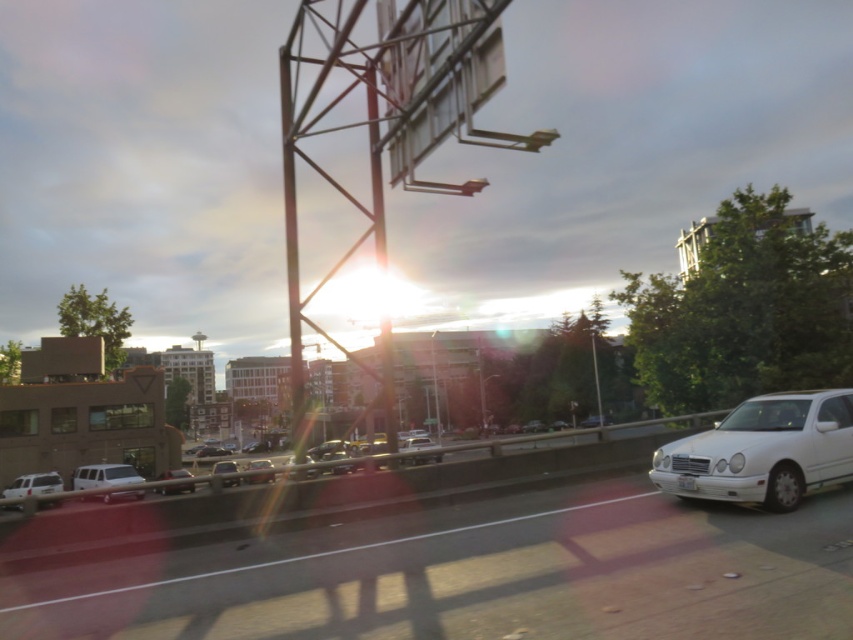
You are a driver in the shiny silver sedan at center. You notice the matte black sedan at center in front of you. If you want to overtake it, which direction should you choose based on the road layout?

The matte black sedan at center is in front of the shiny silver sedan at center, so to overtake it, you should move to the left lane since vehicles typically overtake from the left in many countries. However, always check local traffic rules and ensure it is safe before changing lanes.

You are a pedestrian standing on the sidewalk and see both the matte black sedan at center and the shiny silver sedan at center driving on the highway. Which car appears smaller in size?

The matte black sedan at center appears smaller in size compared to the shiny silver sedan at center.

You are a pedestrian standing on the sidewalk and see the white matte van at left and the white plastic license plate at center. Which object is closer to your left side?

The white matte van at left is closer to your left side because it is positioned to the left of the white plastic license plate at center.